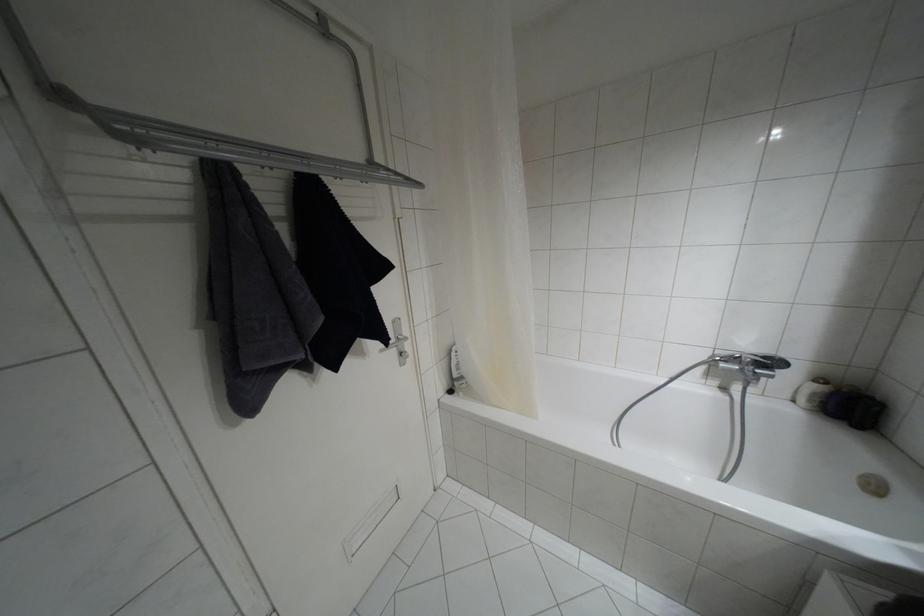
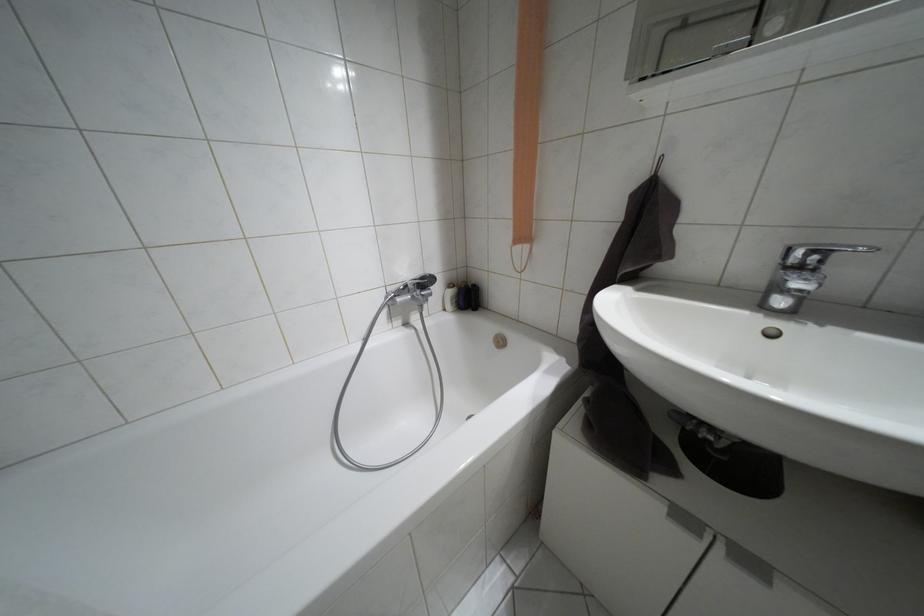
Question: The camera is either moving clockwise (left) or counter-clockwise (right) around the object. The first image is from the beginning of the video and the second image is from the end. Is the camera moving left or right when shooting the video?

Choices:
 (A) Left
 (B) Right

Answer: (A)